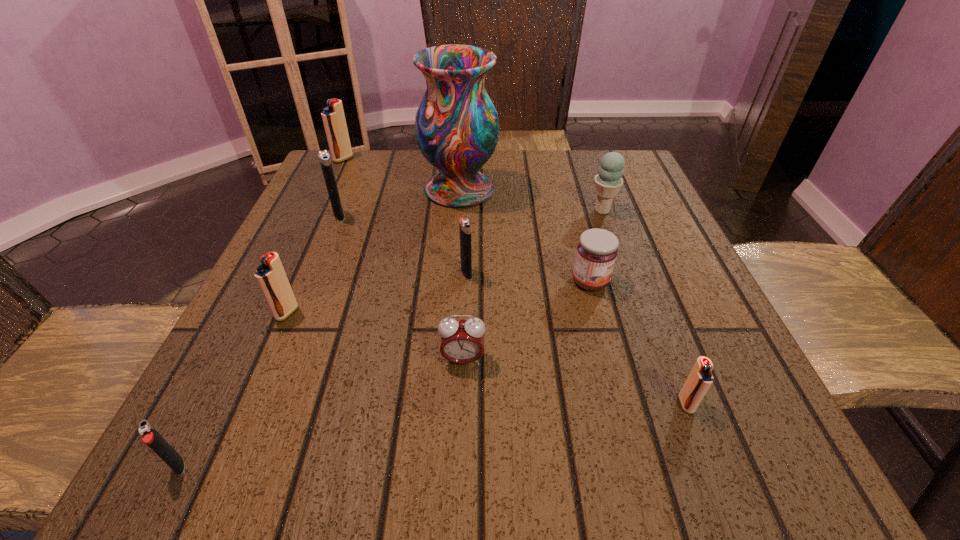
I want to click on the tallest object, so click(456, 125).

At what (x,y) coordinates should I click in order to perform the action: click on the farthest object. Please return your answer as a coordinate pair (x, y). The image size is (960, 540). Looking at the image, I should click on (333, 117).

The height and width of the screenshot is (540, 960). What are the coordinates of `the farthest igniter` in the screenshot? It's located at (333, 117).

What are the coordinates of `the farthest black igniter` in the screenshot? It's located at (324, 158).

The height and width of the screenshot is (540, 960). Find the location of `the second farthest igniter`. the second farthest igniter is located at coordinates (324, 158).

I want to click on blue ice cream, so click(608, 181).

The width and height of the screenshot is (960, 540). Identify the location of the fourth nearest igniter. (464, 224).

Where is `the second smallest black igniter`? The height and width of the screenshot is (540, 960). the second smallest black igniter is located at coordinates (464, 224).

Find the location of a particular element. This screenshot has width=960, height=540. the second farthest red igniter is located at coordinates (270, 275).

This screenshot has height=540, width=960. I want to click on the fourth nearest object, so click(x=270, y=275).